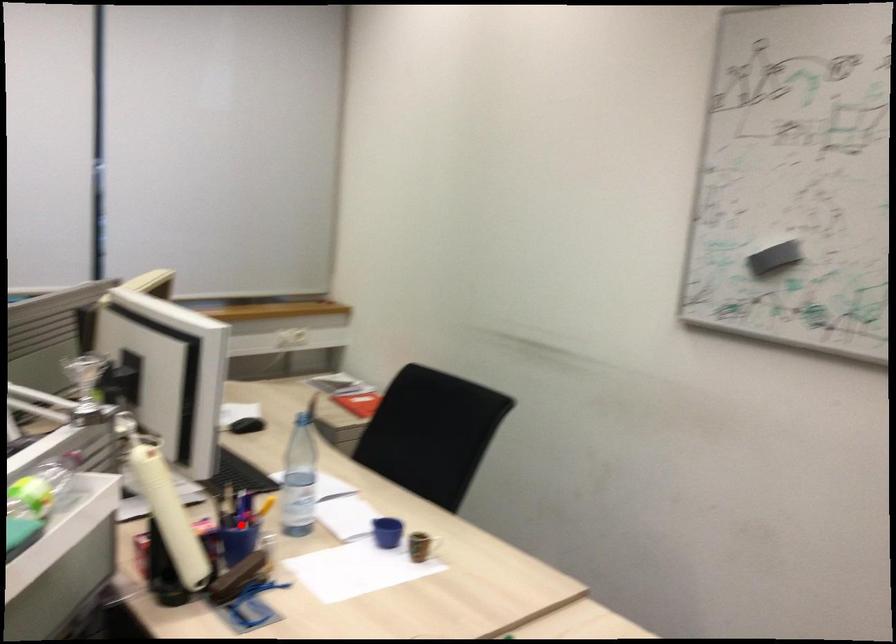
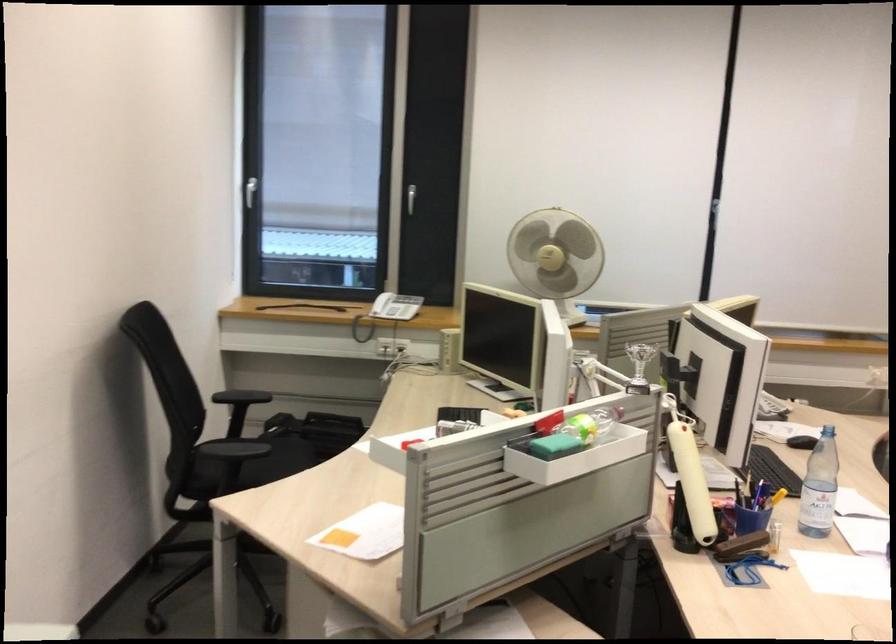
In the second image, find the point that corresponds to the highlighted location in the first image.

(752, 507)